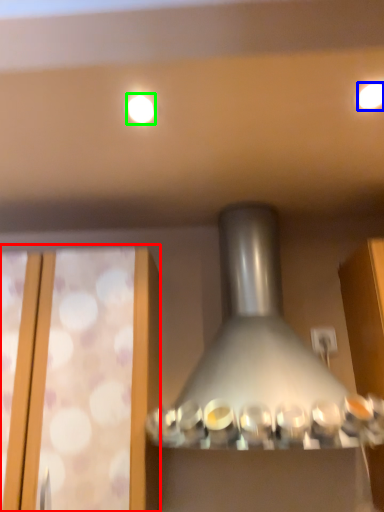
Question: Which is farther away from glass door (highlighted by a red box)? lighting (highlighted by a blue box) or lighting (highlighted by a green box)?

Choices:
 (A) lighting
 (B) lighting

Answer: (A)